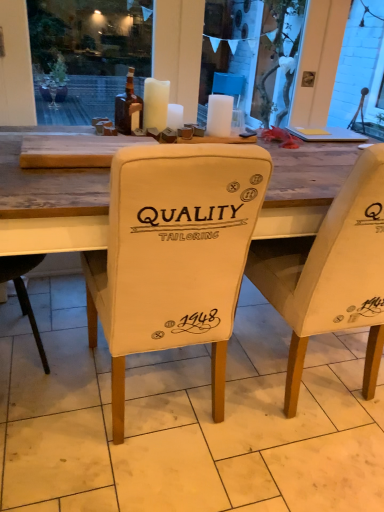
Question: Can you confirm if beige fabric chair at center, the 1th chair positioned from the left, is positioned to the left of white fabric chair cover at center?

Choices:
 (A) no
 (B) yes

Answer: (B)

Question: Can you confirm if beige fabric chair at center, the 1th chair positioned from the left, is shorter than white fabric chair cover at center?

Choices:
 (A) no
 (B) yes

Answer: (A)

Question: Would you say beige fabric chair at center, which is counted as the second chair, starting from the right, is outside white fabric chair cover at center?

Choices:
 (A) no
 (B) yes

Answer: (B)

Question: Is beige fabric chair at center, the 1th chair positioned from the left, positioned with its back to white fabric chair cover at center?

Choices:
 (A) yes
 (B) no

Answer: (B)

Question: Does beige fabric chair at center, which is counted as the second chair, starting from the right, have a larger size compared to white fabric chair cover at center?

Choices:
 (A) no
 (B) yes

Answer: (B)

Question: Based on their positions, is white matte candle at center, which is counted as the second candle, starting from the left, located to the left or right of beige fabric chair at center, the 1th chair positioned from the left?

Choices:
 (A) right
 (B) left

Answer: (A)

Question: Is white matte candle at center, which is counted as the 2th candle, starting from the right, in front of or behind beige fabric chair at center, the 1th chair positioned from the left, in the image?

Choices:
 (A) behind
 (B) front

Answer: (A)

Question: Does point (175, 119) appear closer or farther from the camera than point (201, 197)?

Choices:
 (A) closer
 (B) farther

Answer: (B)

Question: From the image's perspective, is white matte candle at center, which is counted as the 2th candle, starting from the right, above or below beige fabric chair at center, which is counted as the second chair, starting from the right?

Choices:
 (A) below
 (B) above

Answer: (B)

Question: Would you say beige fabric chair at center, the 1th chair when ordered from right to left, is to the left or to the right of white fabric chair cover at center in the picture?

Choices:
 (A) left
 (B) right

Answer: (B)

Question: In terms of width, does beige fabric chair at center, positioned as the second chair in left-to-right order, look wider or thinner when compared to white fabric chair cover at center?

Choices:
 (A) wide
 (B) thin

Answer: (B)

Question: From a real-world perspective, relative to white fabric chair cover at center, is beige fabric chair at center, positioned as the second chair in left-to-right order, vertically above or below?

Choices:
 (A) above
 (B) below

Answer: (A)

Question: Considering their positions, is beige fabric chair at center, positioned as the second chair in left-to-right order, located in front of or behind white fabric chair cover at center?

Choices:
 (A) behind
 (B) front

Answer: (A)

Question: Considering the positions of white matte candle at upper center, arranged as the 3th candle when viewed from the left, and white fabric chair cover at center in the image, is white matte candle at upper center, arranged as the 3th candle when viewed from the left, wider or thinner than white fabric chair cover at center?

Choices:
 (A) thin
 (B) wide

Answer: (A)

Question: Considering the relative positions of white matte candle at upper center, arranged as the 3th candle when viewed from the left, and white fabric chair cover at center in the image provided, is white matte candle at upper center, arranged as the 3th candle when viewed from the left, to the left or to the right of white fabric chair cover at center?

Choices:
 (A) left
 (B) right

Answer: (B)